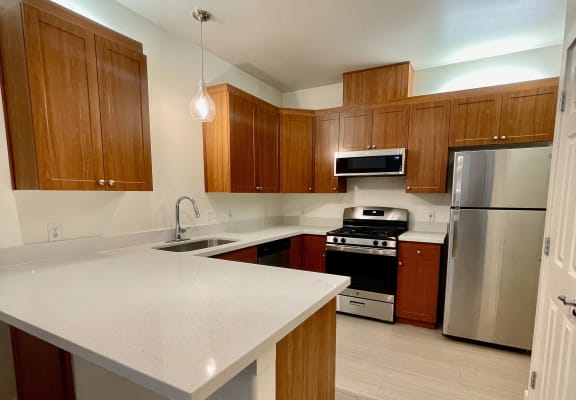
At what (x,y) coordinates should I click in order to perform the action: click on ceiling. Please return your answer as a coordinate pair (x, y). Image resolution: width=576 pixels, height=400 pixels. Looking at the image, I should click on (313, 47).